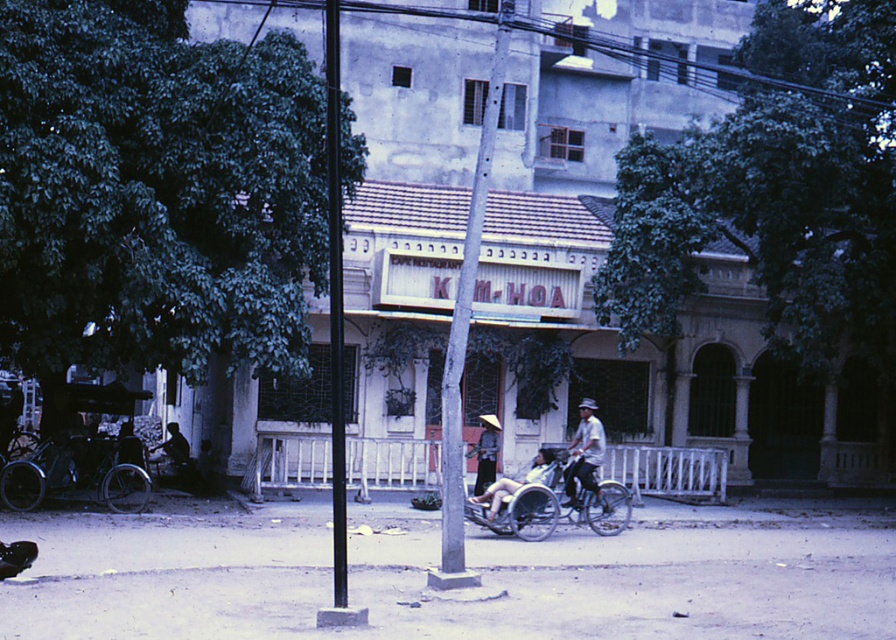
Who is more distant from viewer, (565, 486) or (470, 451)?

The point (470, 451) is behind.

Does light brown wooden bicycle at center have a larger size compared to matte white hat at center?

Yes, light brown wooden bicycle at center is bigger than matte white hat at center.

Find the location of a particular element. This screenshot has height=640, width=896. light brown wooden bicycle at center is located at coordinates (584, 452).

Does gray concrete pole at center have a larger size compared to light brown wooden bicycle at center?

Correct, gray concrete pole at center is larger in size than light brown wooden bicycle at center.

Does gray concrete pole at center appear on the left side of light brown wooden bicycle at center?

Yes, gray concrete pole at center is to the left of light brown wooden bicycle at center.

Where is `gray concrete pole at center`? gray concrete pole at center is located at coordinates (464, 333).

What do you see at coordinates (464, 333) in the screenshot? The width and height of the screenshot is (896, 640). I see `gray concrete pole at center` at bounding box center [464, 333].

Does point (444, 477) come closer to viewer compared to point (493, 483)?

Yes, point (444, 477) is in front of point (493, 483).

At what (x,y) coordinates should I click in order to perform the action: click on gray concrete pole at center. Please return your answer as a coordinate pair (x, y). This screenshot has height=640, width=896. Looking at the image, I should click on (464, 333).